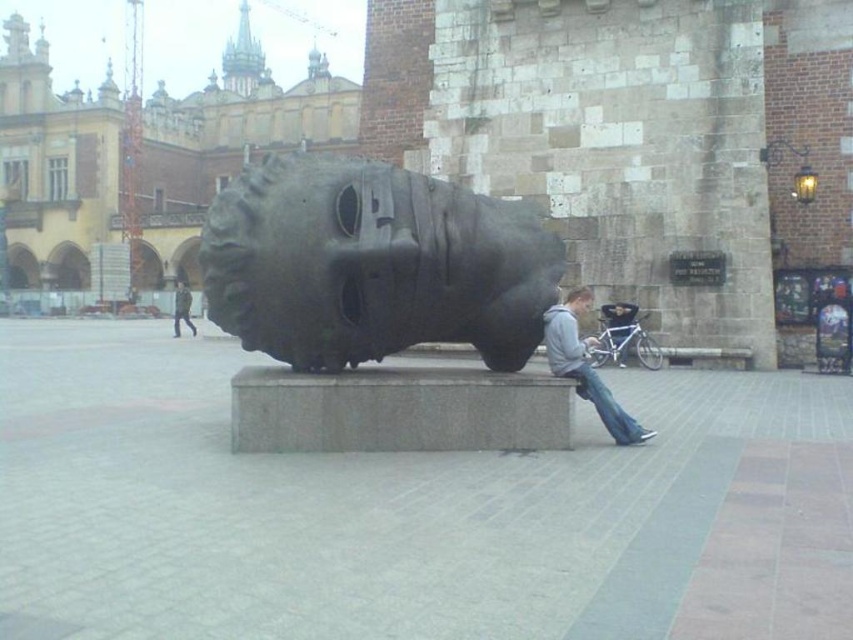
Which of these two, bronze textured sculpture at center or dark gray metallic sculpture at center, stands taller?

Standing taller between the two is bronze textured sculpture at center.

Can you confirm if bronze textured sculpture at center is positioned below dark gray metallic sculpture at center?

Actually, bronze textured sculpture at center is above dark gray metallic sculpture at center.

Locate an element on the screen. This screenshot has width=853, height=640. bronze textured sculpture at center is located at coordinates (373, 264).

What do you see at coordinates (585, 365) in the screenshot? This screenshot has width=853, height=640. I see `gray hoodie at center` at bounding box center [585, 365].

Who is positioned more to the right, gray hoodie at center or blue denim jeans at lower center?

Positioned to the right is gray hoodie at center.

Is point (564, 310) farther from viewer compared to point (593, 376)?

That is True.

Where is `gray hoodie at center`? This screenshot has width=853, height=640. gray hoodie at center is located at coordinates (585, 365).

Does point (276, 157) come closer to viewer compared to point (587, 368)?

No, it is behind (587, 368).

Which is more to the left, bronze textured sculpture at center or gray hoodie at center?

From the viewer's perspective, bronze textured sculpture at center appears more on the left side.

Does point (337, 211) come in front of point (583, 289)?

Yes, it is in front of point (583, 289).

Find the location of a particular element. The image size is (853, 640). bronze textured sculpture at center is located at coordinates (373, 264).